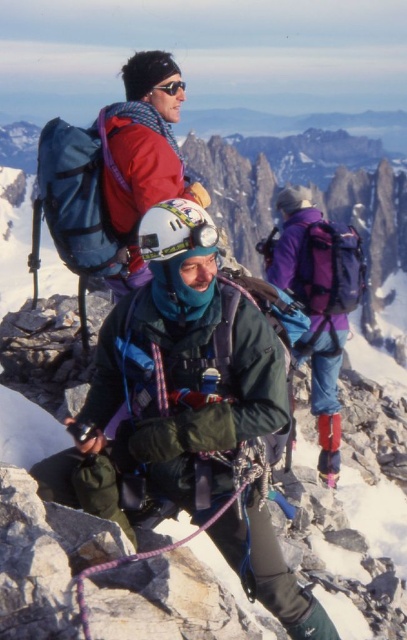
Does point (210, 426) come farther from viewer compared to point (168, 92)?

No, it is not.

Is green fabric jacket at center above matte black goggles at upper center?

Incorrect, green fabric jacket at center is not positioned above matte black goggles at upper center.

Is point (223, 436) in front of point (183, 88)?

Yes, it is.

Identify the location of green fabric jacket at center. The image size is (407, 640). (172, 380).